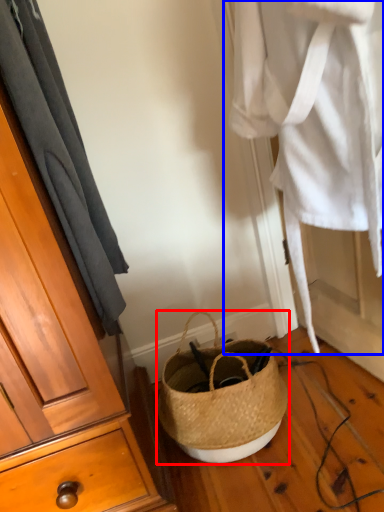
Question: Which object appears farthest to the camera in this image, handbag (highlighted by a red box) or clothing (highlighted by a blue box)?

Choices:
 (A) handbag
 (B) clothing

Answer: (A)